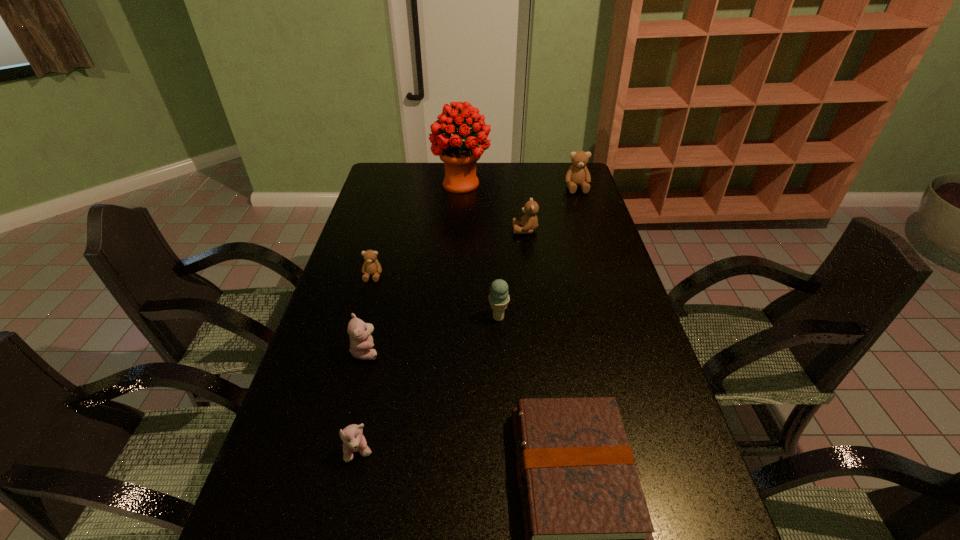
Find the location of a particular element. The width and height of the screenshot is (960, 540). vacant space situated 0.180m on the front-facing side of the leftmost brown teddy bear is located at coordinates (359, 325).

At what (x,y) coordinates should I click in order to perform the action: click on free space located at the face of the nearer pink teddy bear. Please return your answer as a coordinate pair (x, y). This screenshot has height=540, width=960. Looking at the image, I should click on (349, 498).

Identify the location of bouquet that is at the far edge. The height and width of the screenshot is (540, 960). (460, 157).

Where is `teddy bear situated at the far edge`? The width and height of the screenshot is (960, 540). teddy bear situated at the far edge is located at coordinates (577, 175).

Locate an element on the screen. This screenshot has height=540, width=960. object that is at the right edge is located at coordinates (577, 175).

Identify the location of object that is at the far right corner. The height and width of the screenshot is (540, 960). (577, 175).

In the image, there is a desktop. At what (x,y) coordinates should I click in order to perform the action: click on vacant space at the far edge. Please return your answer as a coordinate pair (x, y). This screenshot has height=540, width=960. Looking at the image, I should click on [x=430, y=181].

In the image, there is a desktop. Find the location of `vacant space at the left edge`. vacant space at the left edge is located at coordinates (368, 314).

In the image, there is a desktop. What are the coordinates of `free region at the right edge` in the screenshot? It's located at (639, 461).

At what (x,y) coordinates should I click in order to perform the action: click on vacant area at the far left corner. Please return your answer as a coordinate pair (x, y). Image resolution: width=960 pixels, height=540 pixels. Looking at the image, I should click on (415, 165).